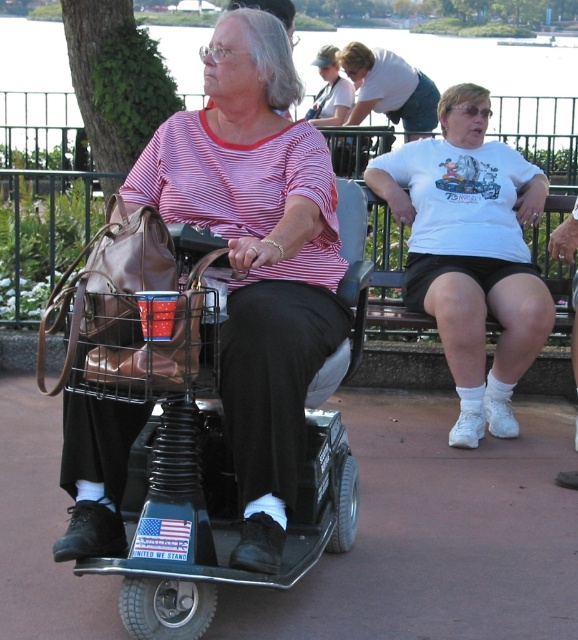
Who is higher up, transparent water at upper center or matte white shirt at upper center?

Positioned higher is transparent water at upper center.

The image size is (578, 640). Describe the element at coordinates (487, 86) in the screenshot. I see `transparent water at upper center` at that location.

The width and height of the screenshot is (578, 640). In order to click on transparent water at upper center in this screenshot , I will do `click(487, 86)`.

At what (x,y) coordinates should I click in order to perform the action: click on transparent water at upper center. Please return your answer as a coordinate pair (x, y). This screenshot has height=640, width=578. Looking at the image, I should click on (487, 86).

Is point (306, 380) positioned after point (476, 49)?

No, (306, 380) is closer to viewer.

Is matte black scooter at center further to the viewer compared to transparent water at upper center?

No, it is not.

What do you see at coordinates (257, 256) in the screenshot? I see `matte black scooter at center` at bounding box center [257, 256].

Image resolution: width=578 pixels, height=640 pixels. Identify the location of matte black scooter at center. (257, 256).

Is white cotton t-shirt at upper right taller than matte white shirt at upper center?

Correct, white cotton t-shirt at upper right is much taller as matte white shirt at upper center.

Who is more forward, (416,205) or (357,93)?

Point (416,205) is more forward.

Which is in front, point (450, 246) or point (372, 65)?

Positioned in front is point (450, 246).

The width and height of the screenshot is (578, 640). I want to click on white cotton t-shirt at upper right, so click(x=470, y=253).